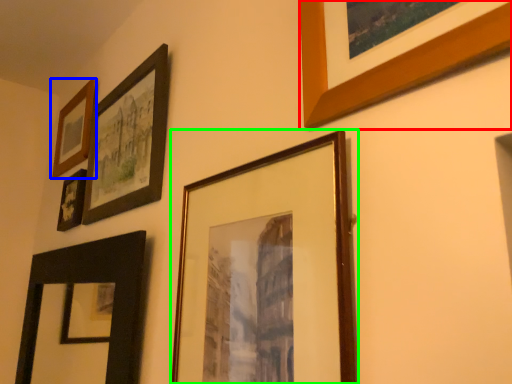
Question: Based on their relative distances, which object is farther from picture frame (highlighted by a red box)? Choose from picture frame (highlighted by a blue box) and picture frame (highlighted by a green box).

Choices:
 (A) picture frame
 (B) picture frame

Answer: (A)